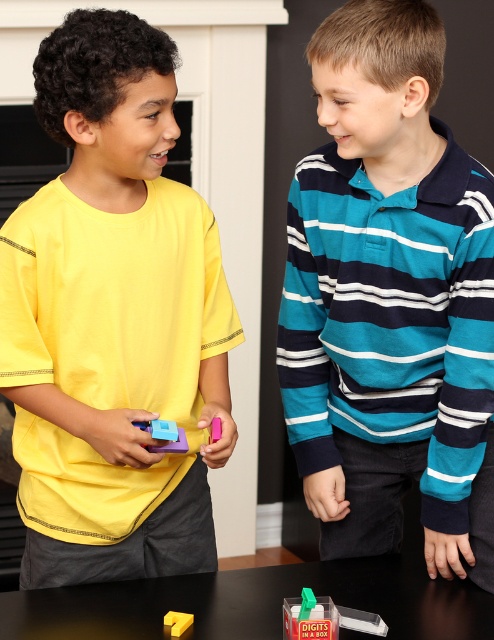
Does teal striped shirt at center appear over translucent plastic container at center?

Indeed, teal striped shirt at center is positioned over translucent plastic container at center.

Is teal striped shirt at center to the right of translucent plastic container at center from the viewer's perspective?

Yes, teal striped shirt at center is to the right of translucent plastic container at center.

Where is `teal striped shirt at center`? teal striped shirt at center is located at coordinates (389, 300).

Is translucent plastic container at center above yellow matte block at center?

Yes.

Is translucent plastic container at center further to the viewer compared to yellow matte block at center?

That is False.

Which is behind, point (310, 609) or point (173, 625)?

The point (173, 625) is behind.

Where is `translucent plastic container at center`? The width and height of the screenshot is (494, 640). translucent plastic container at center is located at coordinates (310, 618).

Does translucent plastic container at center have a smaller size compared to matte plastic toy at center?

No.

Is translucent plastic container at center wider than matte plastic toy at center?

Yes.

Locate an element on the screen. The image size is (494, 640). translucent plastic container at center is located at coordinates (310, 618).